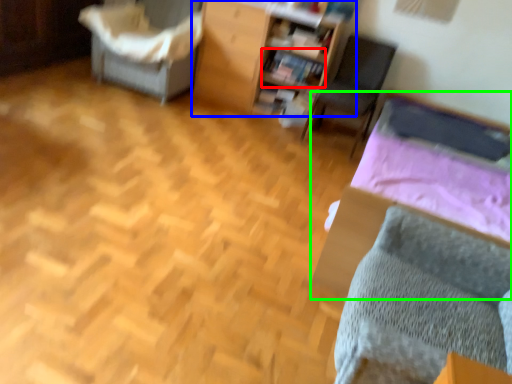
Question: Which object is the closest to the book (highlighted by a red box)? Choose among these: furniture (highlighted by a blue box) or bed (highlighted by a green box).

Choices:
 (A) furniture
 (B) bed

Answer: (A)